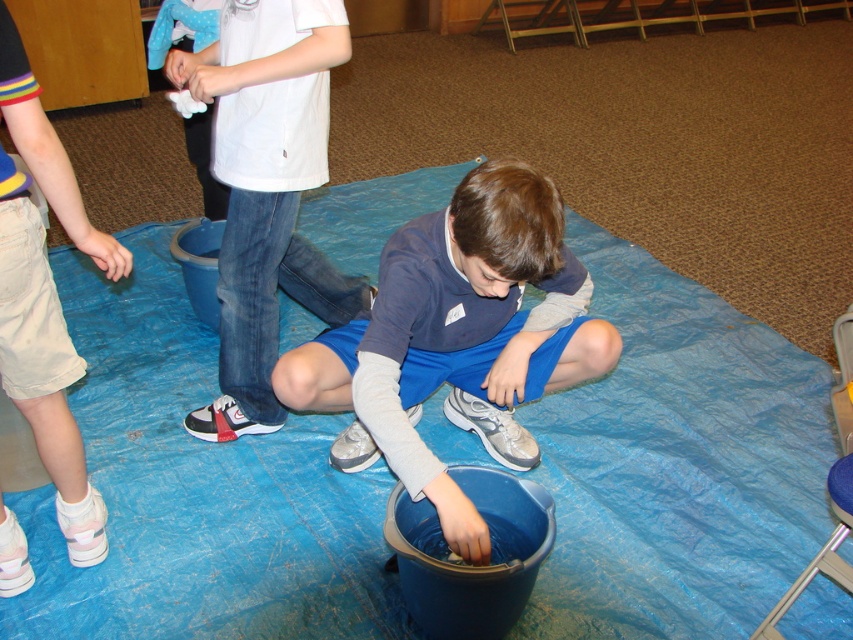
The width and height of the screenshot is (853, 640). I want to click on blue fabric shorts at center, so click(x=457, y=339).

Does blue fabric shorts at center appear on the right side of white matte shirt at upper center?

Correct, you'll find blue fabric shorts at center to the right of white matte shirt at upper center.

At what (x,y) coordinates should I click in order to perform the action: click on blue fabric shorts at center. Please return your answer as a coordinate pair (x, y). Image resolution: width=853 pixels, height=640 pixels. Looking at the image, I should click on tap(457, 339).